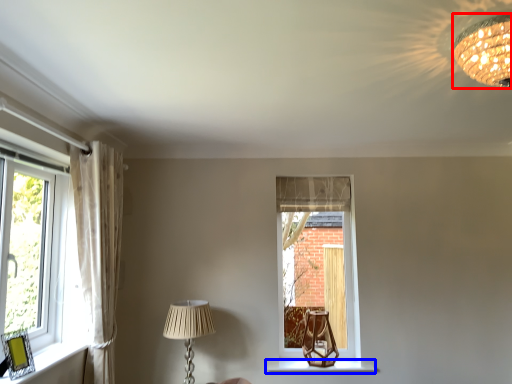
Question: Which object is closer to the camera taking this photo, lamp (highlighted by a red box) or window sill (highlighted by a blue box)?

Choices:
 (A) lamp
 (B) window sill

Answer: (A)